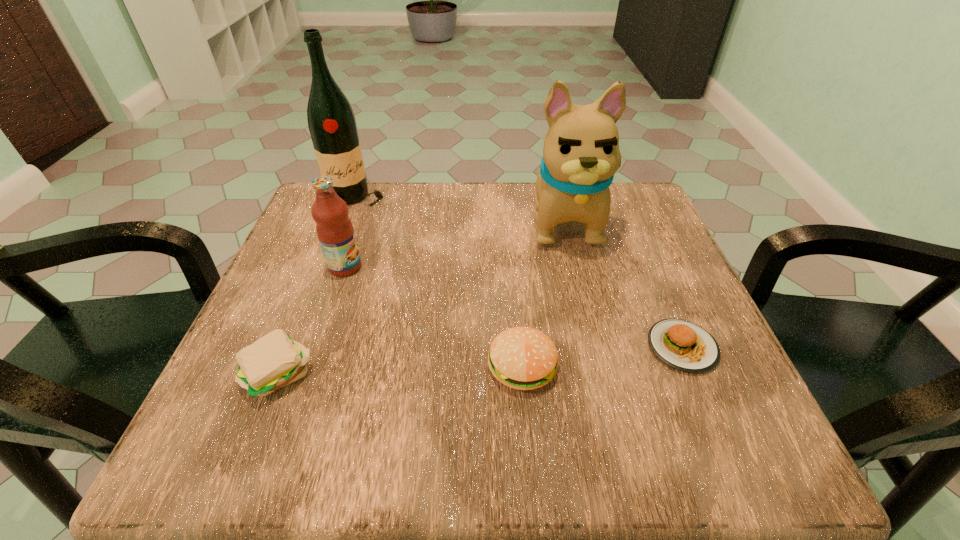
This screenshot has height=540, width=960. What are the coordinates of `object that is at the far left corner` in the screenshot? It's located at (331, 121).

The height and width of the screenshot is (540, 960). Find the location of `object positioned at the far right corner`. object positioned at the far right corner is located at coordinates (581, 154).

The height and width of the screenshot is (540, 960). In order to click on free region at the far edge of the desktop in this screenshot , I will do `click(440, 231)`.

What are the coordinates of `vacant area at the near edge` in the screenshot? It's located at (619, 450).

Locate an element on the screen. This screenshot has height=540, width=960. vacant space at the left edge of the desktop is located at coordinates (316, 303).

Where is `free space at the right edge of the desktop`? The height and width of the screenshot is (540, 960). free space at the right edge of the desktop is located at coordinates (687, 312).

Image resolution: width=960 pixels, height=540 pixels. What are the coordinates of `vacant region at the far left corner` in the screenshot? It's located at (362, 206).

The height and width of the screenshot is (540, 960). I want to click on vacant area at the near left corner, so click(x=201, y=463).

This screenshot has width=960, height=540. I want to click on free space at the near right corner of the desktop, so click(x=713, y=466).

The width and height of the screenshot is (960, 540). I want to click on unoccupied area between the wine bottle and the leftmost food, so click(x=317, y=287).